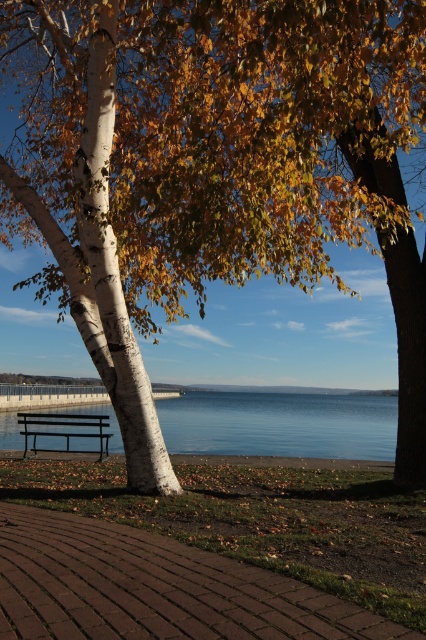
You are standing at the point marked by coordinates point (154,588), which is on the brown brick path at lower center. You want to walk towards the two birch trees in the foreground. Which direction should you head?

You should head north because the two birch trees in the foreground are located north of the brown brick path at lower center.

You are standing at the center of the paved brick pathway leading towards the grassy area. Which direction should you walk to reach the white bark birch tree at left?

The white bark birch tree at left is located at point 0.414 on the x and 0.242 on the y axis. Since you are at the center of the pathway, you should walk towards the left direction to reach it.